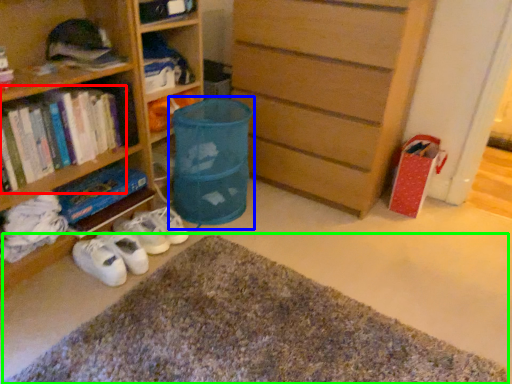
Question: Based on their relative distances, which object is farther from book (highlighted by a red box)? Choose from laundry basket (highlighted by a blue box) and doormat (highlighted by a green box).

Choices:
 (A) laundry basket
 (B) doormat

Answer: (B)